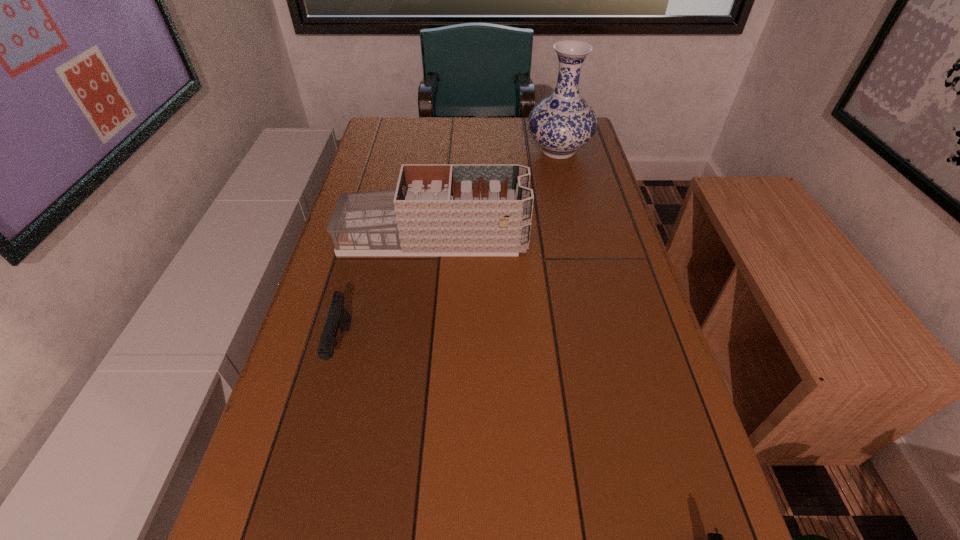
Find the location of `the closest object to the third tallest object`. the closest object to the third tallest object is located at coordinates (437, 209).